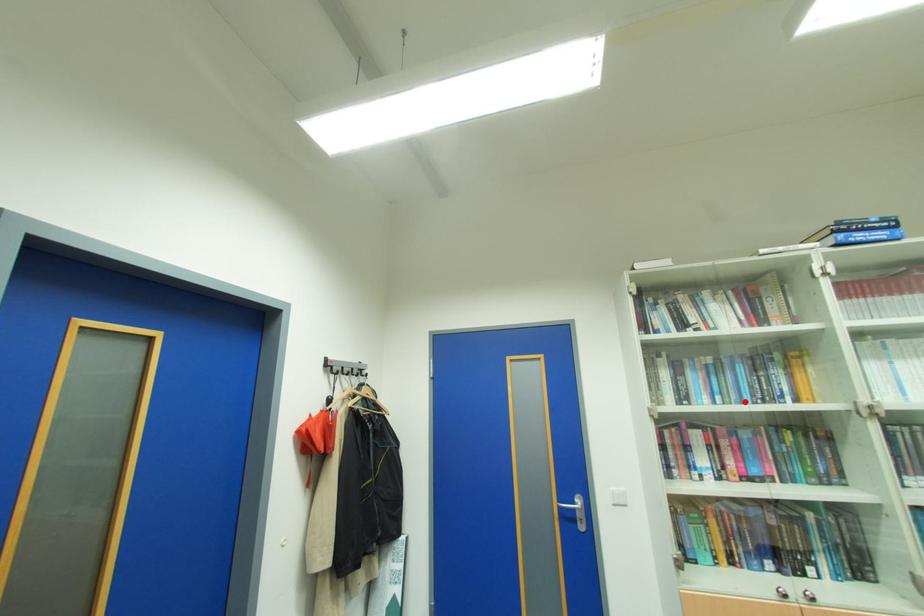
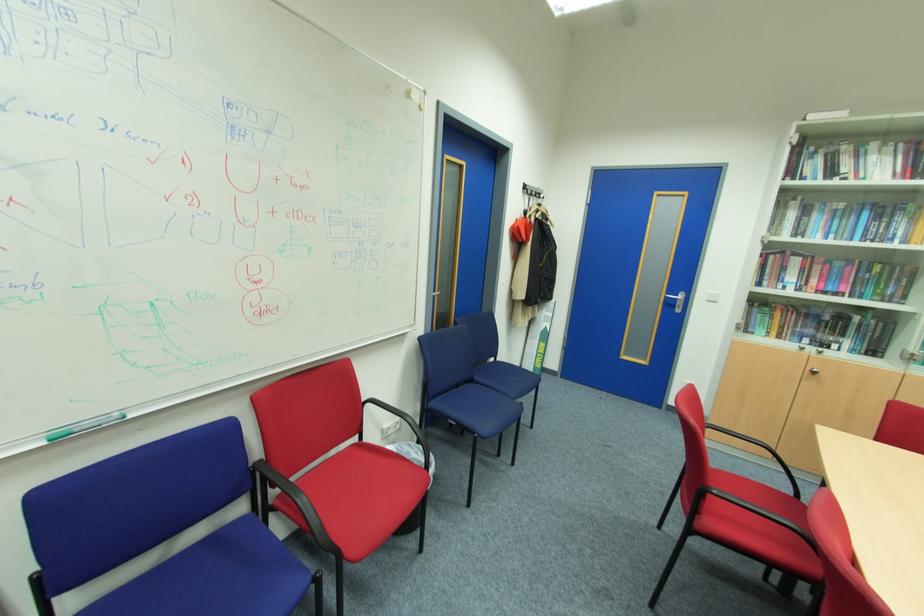
Question: I am providing you with two images of the same scene from different viewpoints. A red point is marked on the first image. At the location where the point appears in image 1, is it still visible in image 2?

Choices:
 (A) Yes
 (B) No

Answer: (A)